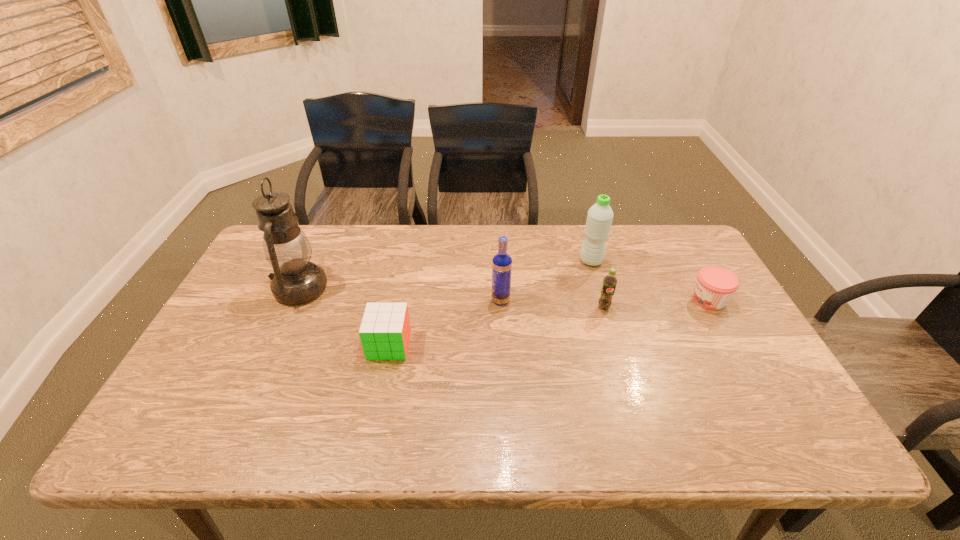
Where is `oil lamp`? This screenshot has width=960, height=540. oil lamp is located at coordinates (296, 280).

Identify the location of the leftmost object. The height and width of the screenshot is (540, 960). (296, 280).

Locate an element on the screen. Image resolution: width=960 pixels, height=540 pixels. water bottle is located at coordinates (599, 219).

Where is `the third object from left to right`? Image resolution: width=960 pixels, height=540 pixels. the third object from left to right is located at coordinates (502, 262).

Image resolution: width=960 pixels, height=540 pixels. I want to click on the third shortest object, so click(610, 281).

The width and height of the screenshot is (960, 540). I want to click on cube, so click(385, 330).

You are a GUI agent. You are given a task and a screenshot of the screen. Output one action in this format:
    pyautogui.click(x=<x>, y=<y>)
    Task: Click on the second object from left to right
    The height and width of the screenshot is (540, 960).
    Given the screenshot: What is the action you would take?
    pyautogui.click(x=385, y=330)

The width and height of the screenshot is (960, 540). What are the coordinates of `jam` in the screenshot? It's located at (715, 285).

Image resolution: width=960 pixels, height=540 pixels. I want to click on the rightmost object, so click(715, 285).

The height and width of the screenshot is (540, 960). What are the coordinates of `vacant space located on the back of the oil lamp` in the screenshot? It's located at (325, 233).